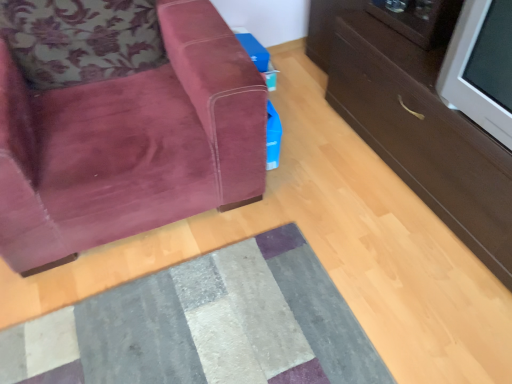
The height and width of the screenshot is (384, 512). I want to click on free space in front of velvet maroon armchair at left, so click(158, 306).